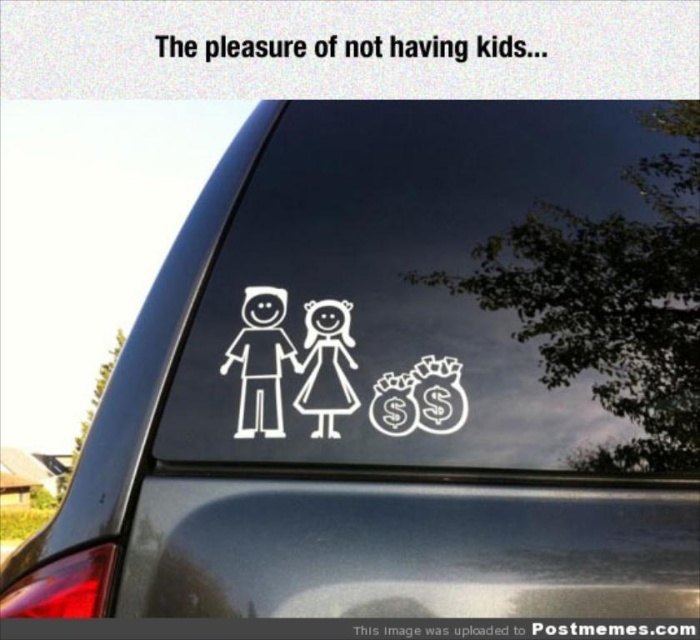
Question: Is white matte figure at center above white glossy money bags at center?

Choices:
 (A) no
 (B) yes

Answer: (B)

Question: Can you confirm if transparent vinyl sticker at center is positioned to the right of white glossy money bags at center?

Choices:
 (A) no
 (B) yes

Answer: (A)

Question: Which object is closer to the camera taking this photo?

Choices:
 (A) white glossy money bags at center
 (B) white matte figure at center
 (C) transparent vinyl sticker at center
 (D) white paper doll at center

Answer: (C)

Question: Which of these objects is positioned farthest from the white paper doll at center?

Choices:
 (A) white matte figure at center
 (B) transparent vinyl sticker at center

Answer: (B)

Question: Is transparent vinyl sticker at center bigger than white paper doll at center?

Choices:
 (A) yes
 (B) no

Answer: (A)

Question: Which point is farther to the camera?

Choices:
 (A) white matte figure at center
 (B) white glossy money bags at center
 (C) transparent vinyl sticker at center
 (D) white paper doll at center

Answer: (A)